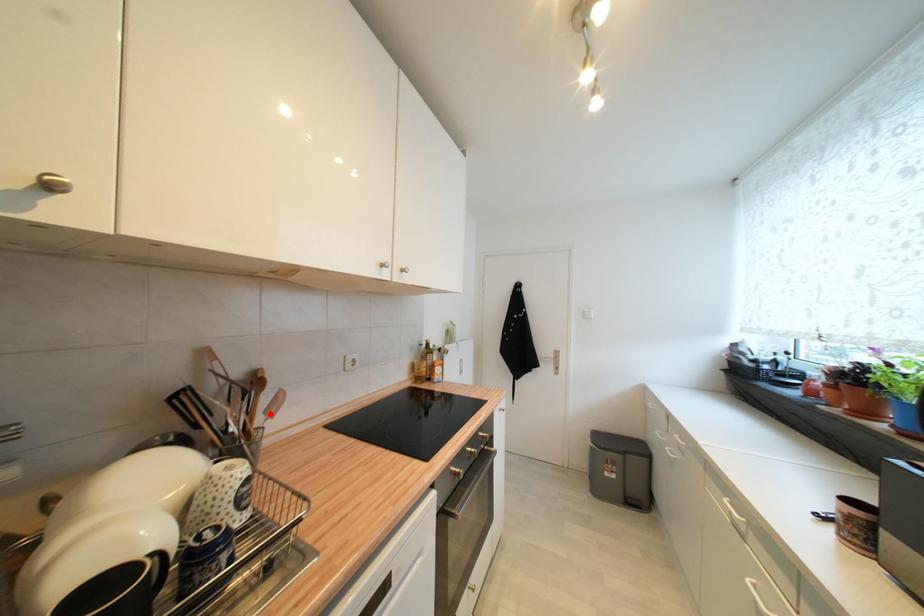
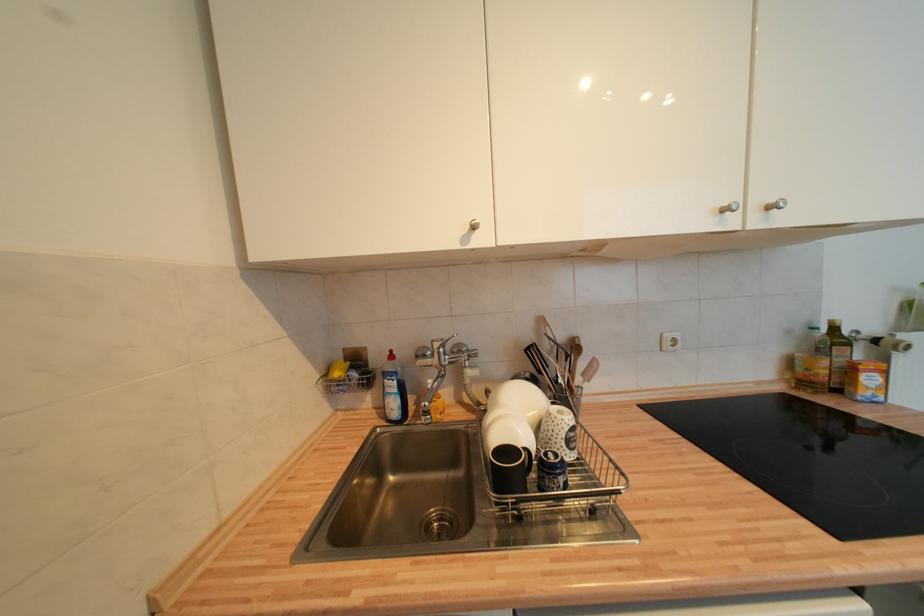
Question: I am providing you with two images of the same scene from different viewpoints. A red point is marked on the first image. Is the red point's position out of view in image 2?

Choices:
 (A) Yes
 (B) No

Answer: (B)